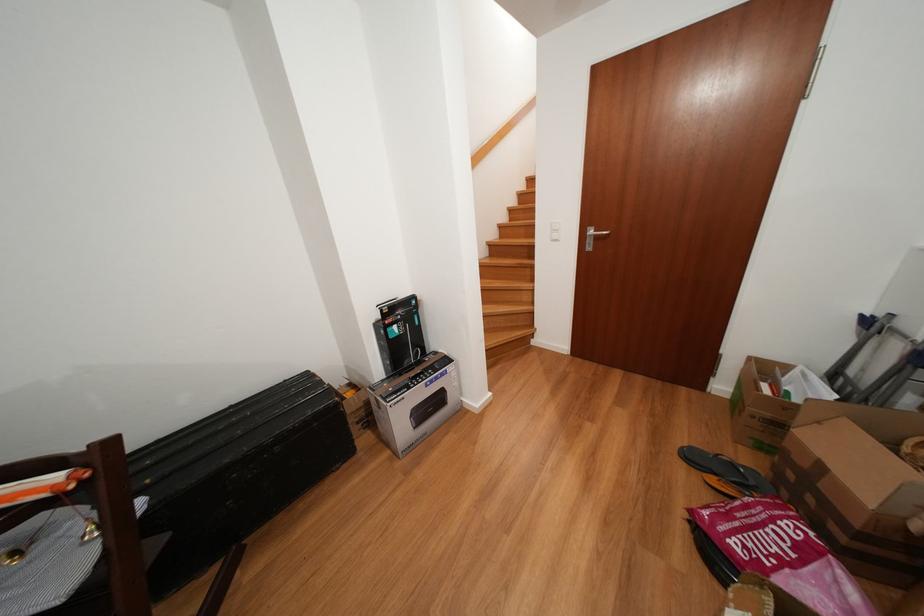
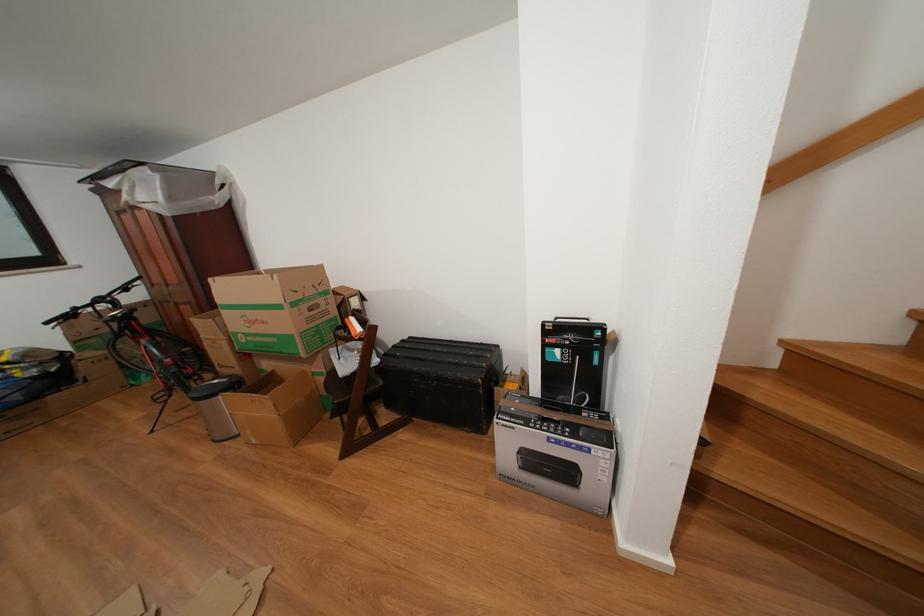
Find the pixel in the second image that matches point 294,387 in the first image.

(490, 349)